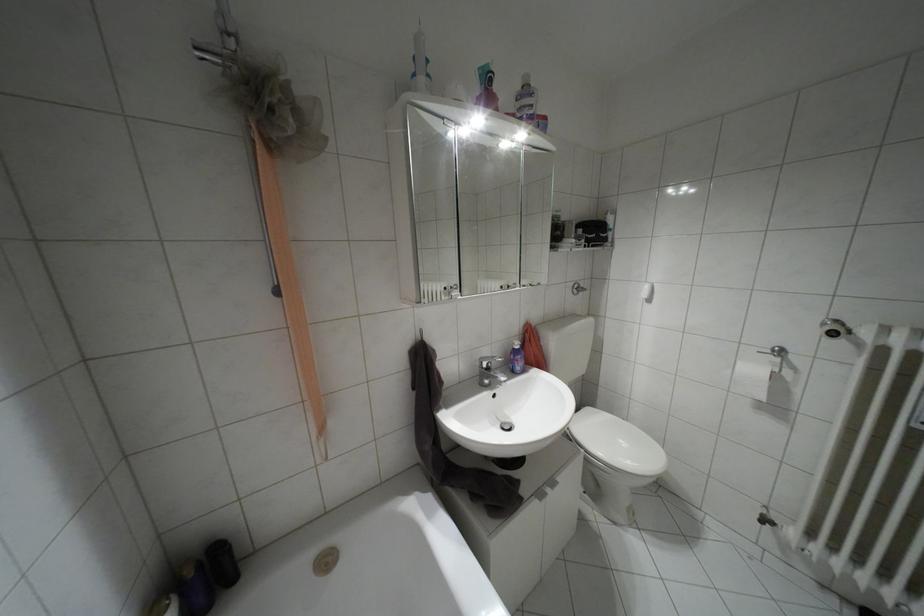
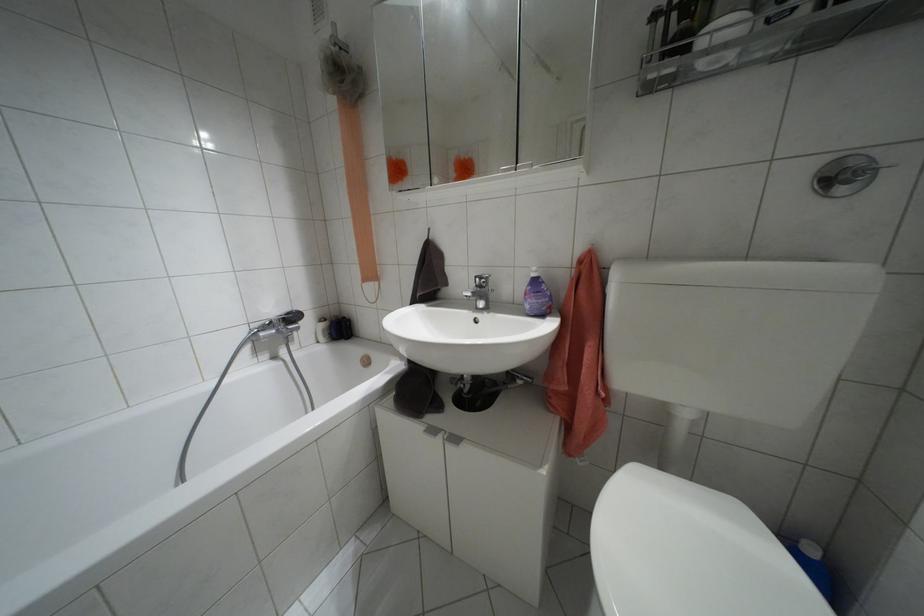
Find the pixel in the second image that matches (x=517, y=346) in the first image.

(532, 274)